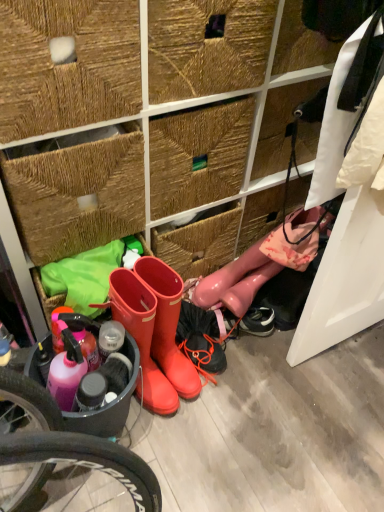
Question: In terms of height, does glossy pink boots at lower right, which is counted as the third footwear, starting from the left, look taller or shorter compared to rubber boots at center, which is the 2th footwear from left to right?

Choices:
 (A) short
 (B) tall

Answer: (A)

Question: Choose the correct answer: Is glossy pink boots at lower right, marked as the first footwear in a right-to-left arrangement, inside rubber boots at center, which is the 2th footwear from left to right, or outside it?

Choices:
 (A) inside
 (B) outside

Answer: (B)

Question: Estimate the real-world distances between objects in this image. Which object is farther from the rubber boots at center, the 1th footwear viewed from the left?

Choices:
 (A) glossy pink boots at lower right, which is counted as the third footwear, starting from the left
 (B) rubber boots at center, which appears as the second footwear when viewed from the right

Answer: (A)

Question: Which of these objects is positioned farthest from the rubber boots at center, which is the 2th footwear from left to right?

Choices:
 (A) rubber boots at center, the 3th footwear positioned from the right
 (B) glossy pink boots at lower right, which is counted as the third footwear, starting from the left

Answer: (B)